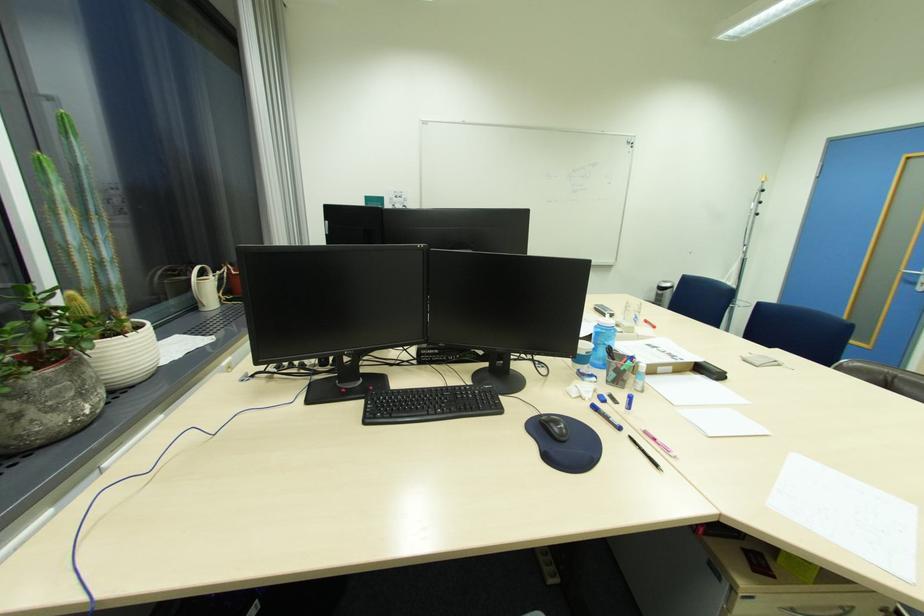
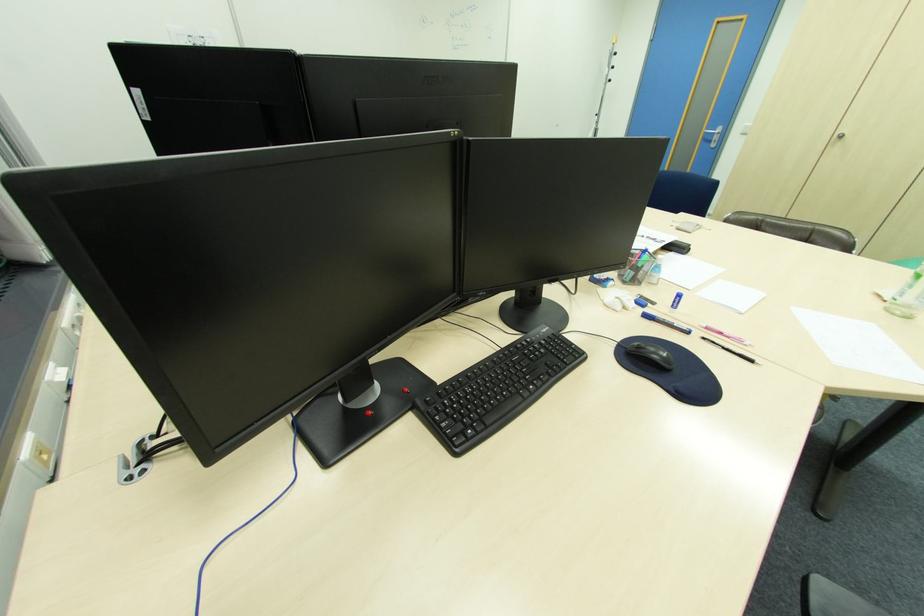
Find the pixel in the second image that matches pixel 636 438 in the first image.

(709, 339)